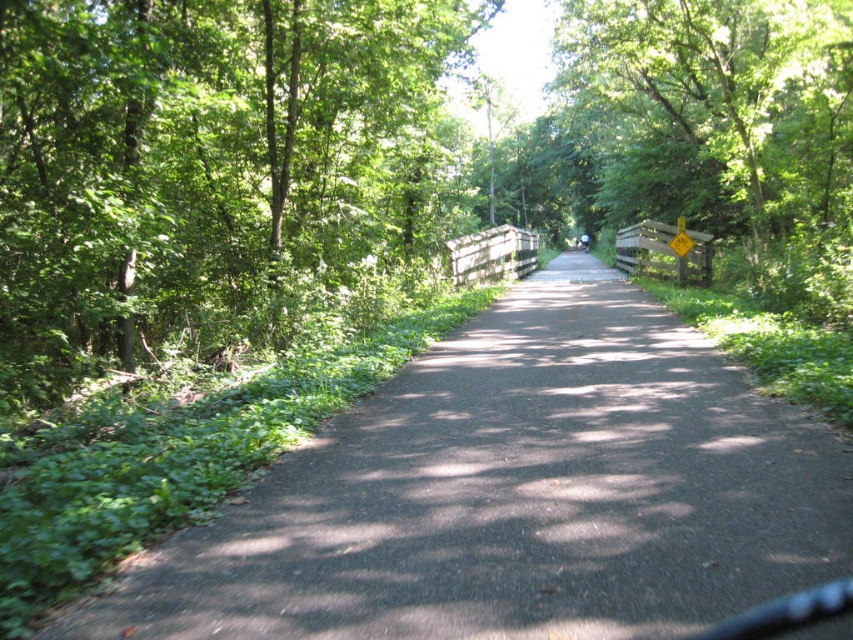
Question: Which object is farther from the camera taking this photo?

Choices:
 (A) black asphalt path at center
 (B) green leafy tree at left

Answer: (B)

Question: Can you confirm if black asphalt path at center is wider than green leafy tree at left?

Choices:
 (A) no
 (B) yes

Answer: (A)

Question: Can you confirm if black asphalt path at center is smaller than green leafy tree at left?

Choices:
 (A) no
 (B) yes

Answer: (B)

Question: Which object appears farthest from the camera in this image?

Choices:
 (A) green leafy tree at left
 (B) black asphalt path at center

Answer: (A)

Question: Does black asphalt path at center lie in front of green leafy tree at left?

Choices:
 (A) yes
 (B) no

Answer: (A)